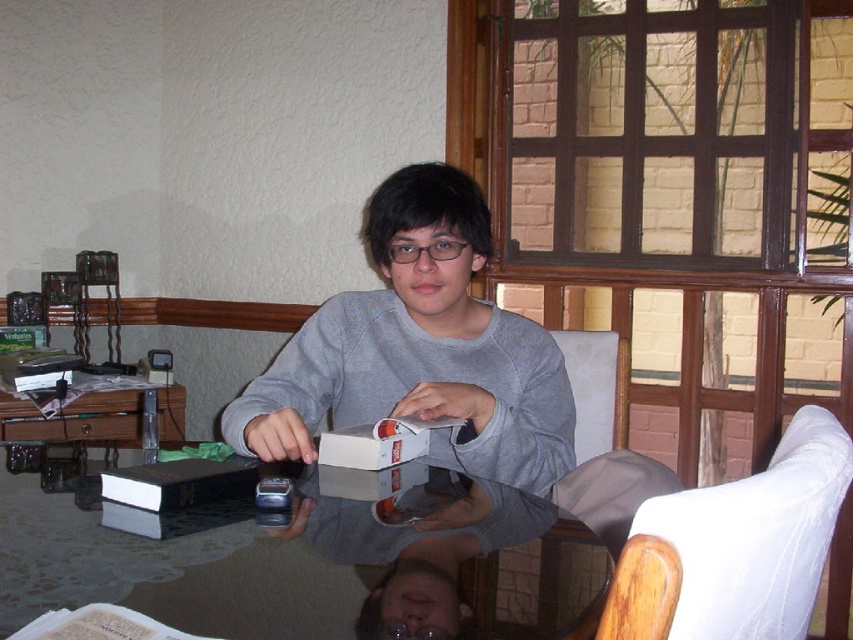
You are trying to place a tall vase on the transparent glass table at center. The vase is 1.2 meters in height. Can the vase be placed on the table without touching the white fabric armchair at right?

The transparent glass table at center is not as tall as the white fabric armchair at right, meaning the table is shorter. Since the vase is 1.2 meters tall, placing it on the table might cause it to come into contact with the taller armchair. Therefore, the vase cannot be safely placed there without risking contact.

You are sitting in the white fabric armchair at center and want to place a drink on the transparent glass table at center. Is the table within easy reach from your current position?

The transparent glass table at center is to the left of the white fabric armchair at center, so it should be within easy reach from your current position.

You are standing in the room and want to place a 1 meter long object on the transparent glass table at center. Can you fit it entirely on the table?

The transparent glass table at center is 83.84 centimeters away from viewer, but this distance does not indicate the table size. Without knowing the table dimensions, it is impossible to determine if the 1 meter long object will fit.